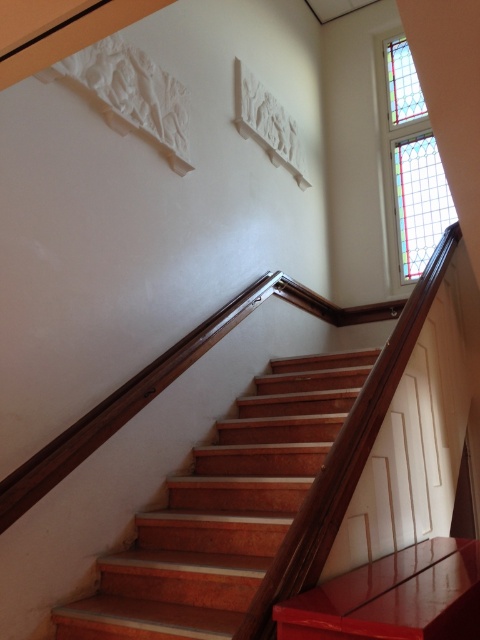
You are a delivery person carrying a package that requires a clear path of 3 meters to maneuver safely. You are standing at the bottom of the wooden stairs at center and need to move towards the stained glass window at upper right. Can you safely navigate through the space between them?

The wooden stairs at center and the stained glass window at upper right are 2.98 meters apart. Since the required clear path is 3 meters, the distance is slightly insufficient, so it is not safe to navigate through the space between them.

You are a delivery robot with a height of 1.6 meters. You need to navigate through the space between the wooden stairs at center and the camera. Can you pass through without hitting your head?

The distance between the wooden stairs at center and the camera is 1.74 meters. Since the robot is 1.6 meters tall, there is enough clearance, so yes, it can pass through without hitting its head.

Consider the image. You are an interior designer assessing the space. You need to determine if a large decorative mirror, which is the same size as the wooden stairs at center, can be placed where the stained glass window at upper right is currently located. Will the mirror fit?

The wooden stairs at center is bigger than the stained glass window at upper right. Since the mirror is the same size as the wooden stairs at center, it will be too large to fit in the space currently occupied by the stained glass window at upper right.